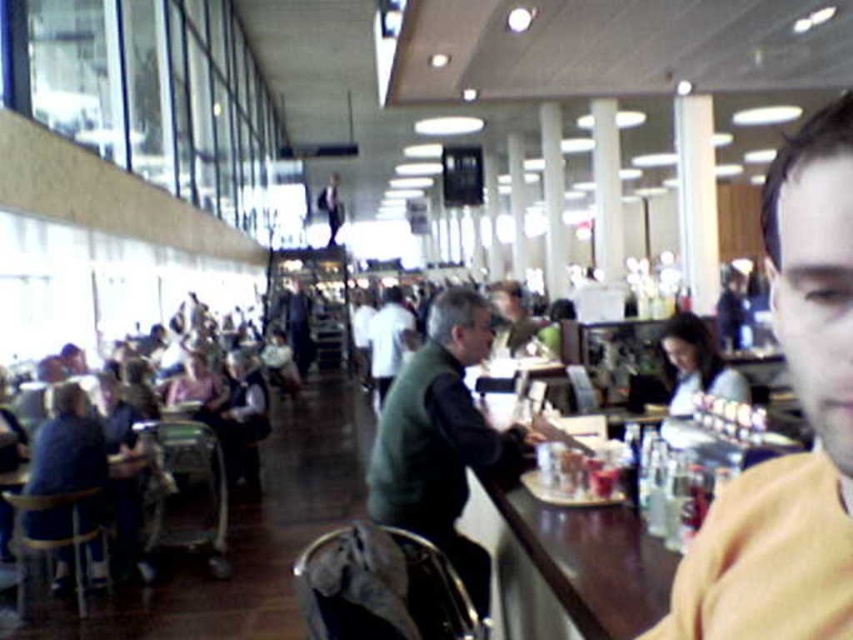
Between wooden table at center and white shirt at center, which one is positioned higher?

white shirt at center is above.

In order to click on wooden table at center in this screenshot , I will do `click(590, 561)`.

Is green fuzzy vest at center in front of wooden table at center?

No.

Which is in front, point (376, 429) or point (662, 548)?

Point (662, 548) is in front.

Between point (442, 509) and point (503, 502), which one is positioned behind?

The point (442, 509) is behind.

At what (x,y) coordinates should I click in order to perform the action: click on green fuzzy vest at center. Please return your answer as a coordinate pair (x, y). Looking at the image, I should click on (442, 438).

Between yellow fabric shirt at right and wooden table at center, which one appears on the left side from the viewer's perspective?

Positioned to the left is wooden table at center.

Identify the location of yellow fabric shirt at right. Image resolution: width=853 pixels, height=640 pixels. (804, 416).